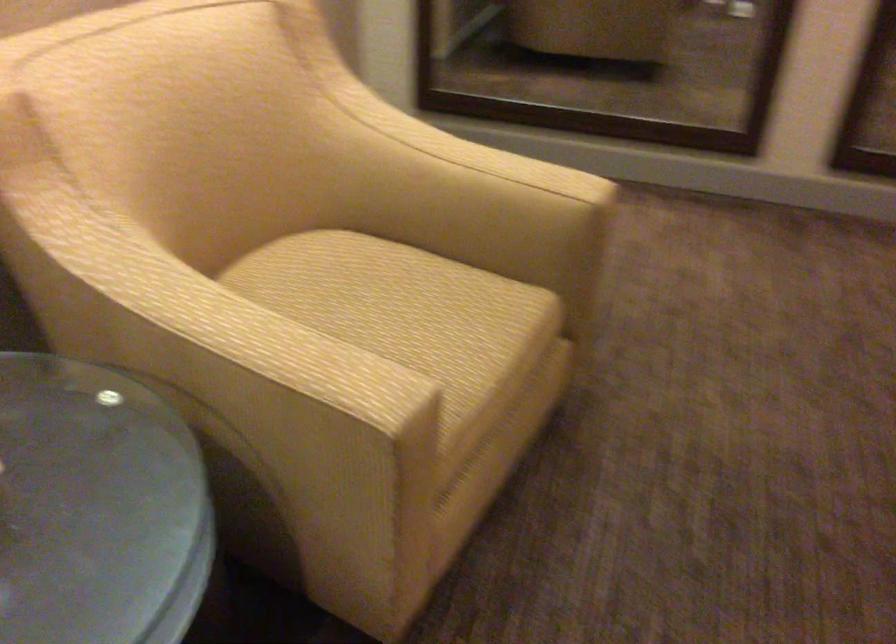
The width and height of the screenshot is (896, 644). Identify the location of yellow chair armrest. (214, 313).